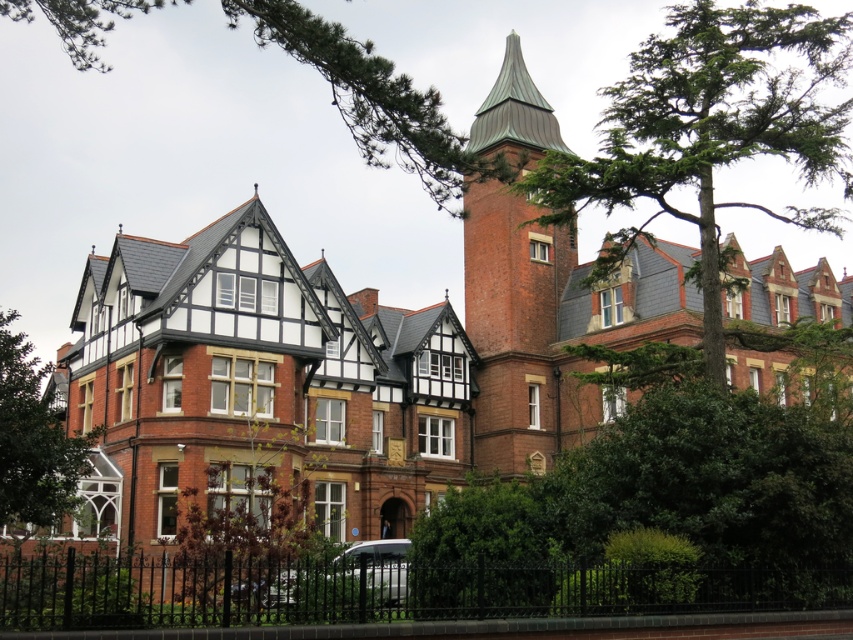
Based on the photo, between green leafy tree at upper right and brick tower at center, which one is positioned higher?

green leafy tree at upper right is higher up.

Between green leafy tree at upper right and brick tower at center, which one has more height?

With more height is green leafy tree at upper right.

Does point (718, 326) come behind point (514, 355)?

No, it is not.

I want to click on green leafy tree at upper right, so click(711, 132).

Find the location of `black wrought iron fence at lower center`. black wrought iron fence at lower center is located at coordinates (380, 589).

Which is more to the left, black wrought iron fence at lower center or brick tower at center?

Positioned to the left is black wrought iron fence at lower center.

You are a GUI agent. You are given a task and a screenshot of the screen. Output one action in this format:
    pyautogui.click(x=<x>, y=<y>)
    Task: Click on the black wrought iron fence at lower center
    Image resolution: width=853 pixels, height=640 pixels.
    Given the screenshot: What is the action you would take?
    pyautogui.click(x=380, y=589)

Who is more distant from viewer, (x=276, y=598) or (x=47, y=524)?

The point (x=276, y=598) is behind.

Locate an element on the screen. green leafy tree at center is located at coordinates (247, 518).